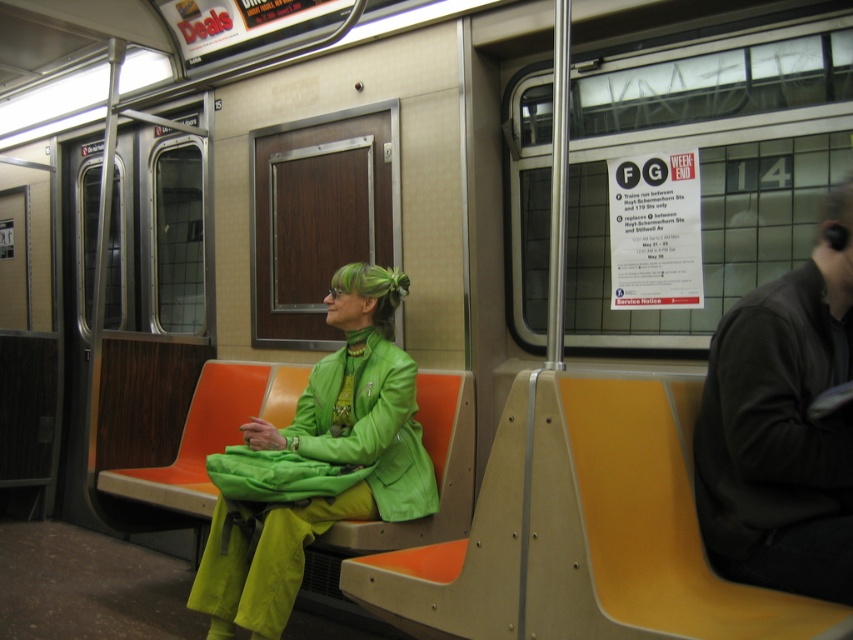
Is dark gray leather jacket at right positioned at the back of green matte jacket at center?

No, it is not.

Does dark gray leather jacket at right have a larger size compared to green matte jacket at center?

Incorrect, dark gray leather jacket at right is not larger than green matte jacket at center.

You are a GUI agent. You are given a task and a screenshot of the screen. Output one action in this format:
    pyautogui.click(x=<x>, y=<y>)
    Task: Click on the dark gray leather jacket at right
    
    Given the screenshot: What is the action you would take?
    pyautogui.click(x=782, y=426)